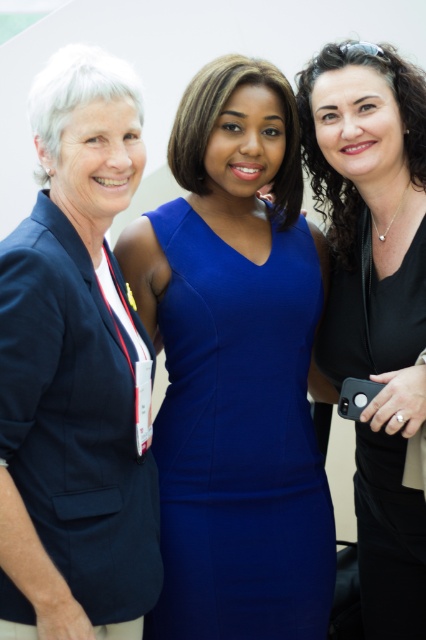
You are a photographer trying to adjust the lighting for a group photo. You notice the matte black blazer at left and the royal blue jersey dress at center. Which clothing item is positioned higher in the image?

The matte black blazer at left is located above the royal blue jersey dress at center, so it is positioned higher in the image.

You are a photographer trying to capture a clear photo of the royal blue jersey dress at center. However, the matte black blazer at left is blocking your view. Can you estimate how much you need to move to the right to get the dress into focus?

The matte black blazer at left is closer to the viewer than the royal blue jersey dress at center, so moving to the right might not be necessary. Instead, moving forward could help bypass the blazer and focus on the dress.

You are a photographer setting up for a group photo. You have a camera with a maximum focus range of 10 inches. You need to ensure that both the royal blue jersey dress at center and the black matte dress at center are in focus. Can you capture both dresses in focus with your current camera settings?

The distance between the royal blue jersey dress at center and the black matte dress at center is 11.49 inches. Since the camera has a maximum focus range of 10 inches, it cannot capture both dresses in focus simultaneously with the current settings.